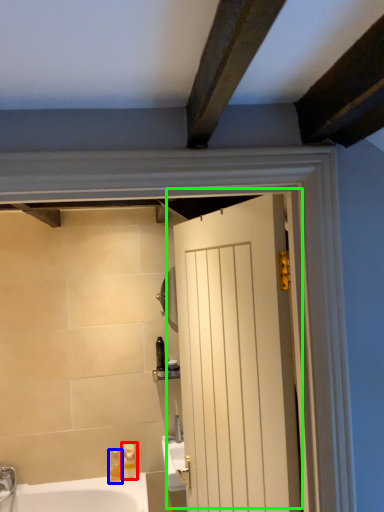
Question: Considering the real-world distances, which object is farthest from soap dispenser (highlighted by a red box)? soap dispenser (highlighted by a blue box) or door (highlighted by a green box)?

Choices:
 (A) soap dispenser
 (B) door

Answer: (B)